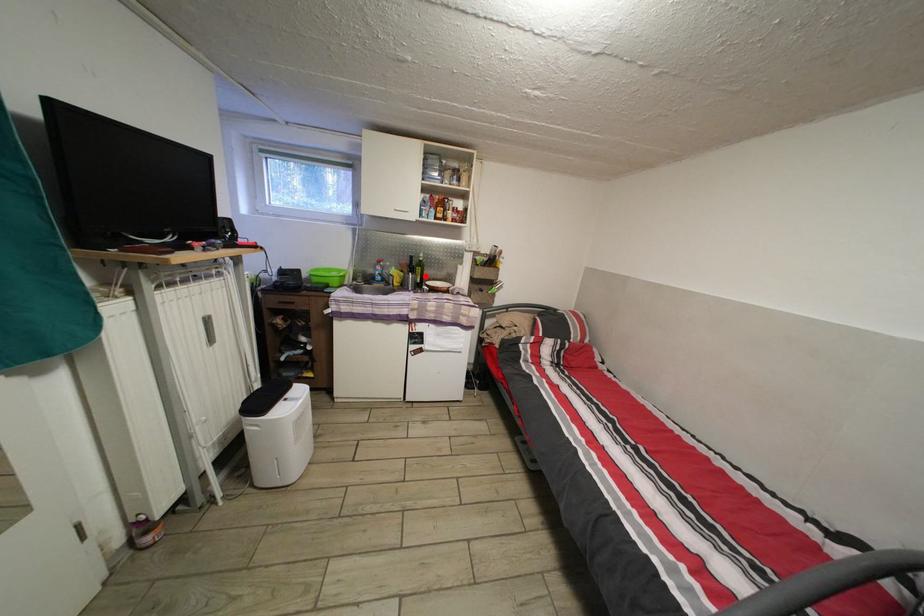
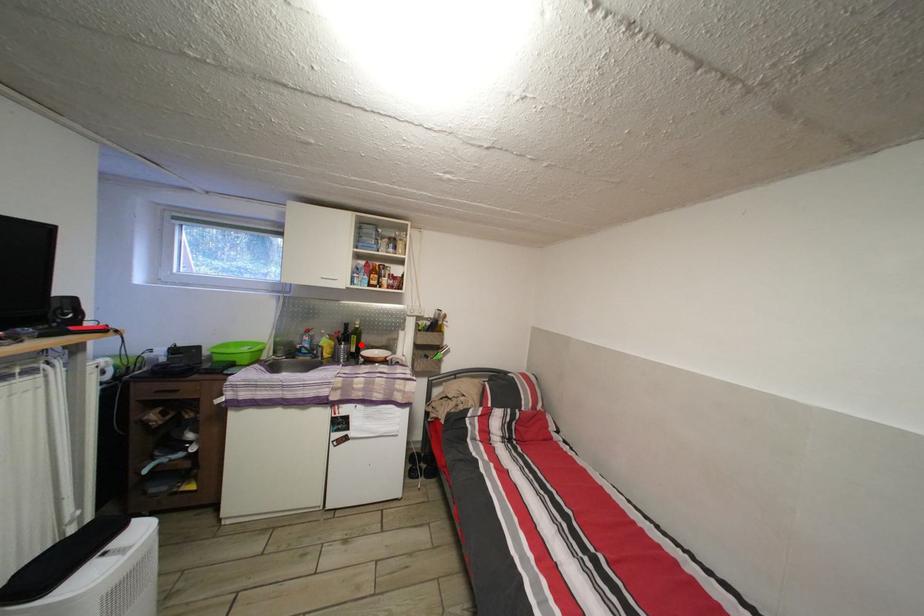
I am providing you with two images of the same scene from different viewpoints. A red point is marked on the first image and another point is marked on the second image. Do the highlighted points in image1 and image2 indicate the same real-world spot?

Yes